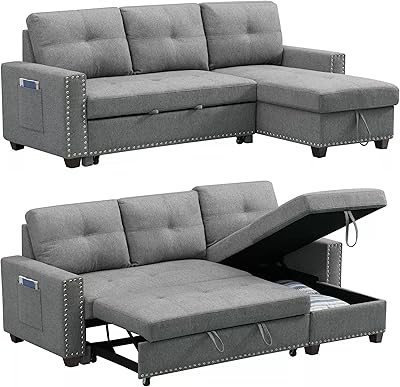
I want to click on rod, so click(x=132, y=338), click(x=90, y=322).